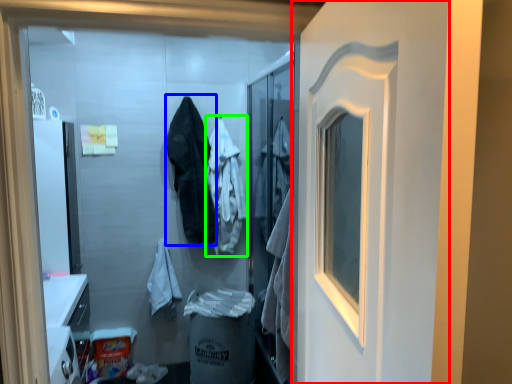
Question: Estimate the real-world distances between objects in this image. Which object is farther from door (highlighted by a red box), clothing (highlighted by a blue box) or clothing (highlighted by a green box)?

Choices:
 (A) clothing
 (B) clothing

Answer: (B)